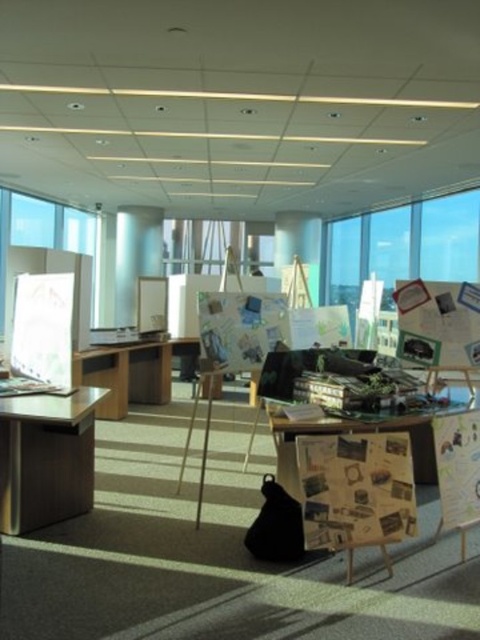
You are a visitor in the office and need to place a large presentation board on a surface. The board is 1.5 meters tall. Which object between the wooden glass table at center and the wooden bulletin board at center right is suitable for placing the board without it being too tall?

The wooden bulletin board at center right is taller than the wooden glass table at center, so the wooden bulletin board at center right is suitable for placing the large presentation board as it can accommodate the 1.5 meters height.

You are a delivery person who needs to place a large package on the wooden glass table at center. The package is 30 feet long. Can you move it from the transparent glass window at upper left to the table without bending or rotating it?

The distance between the wooden glass table at center and the transparent glass window at upper left is 29.67 feet. Since the package is 30 feet long, it cannot be moved in a straight line without bending or rotating it because the distance is shorter than the package length.